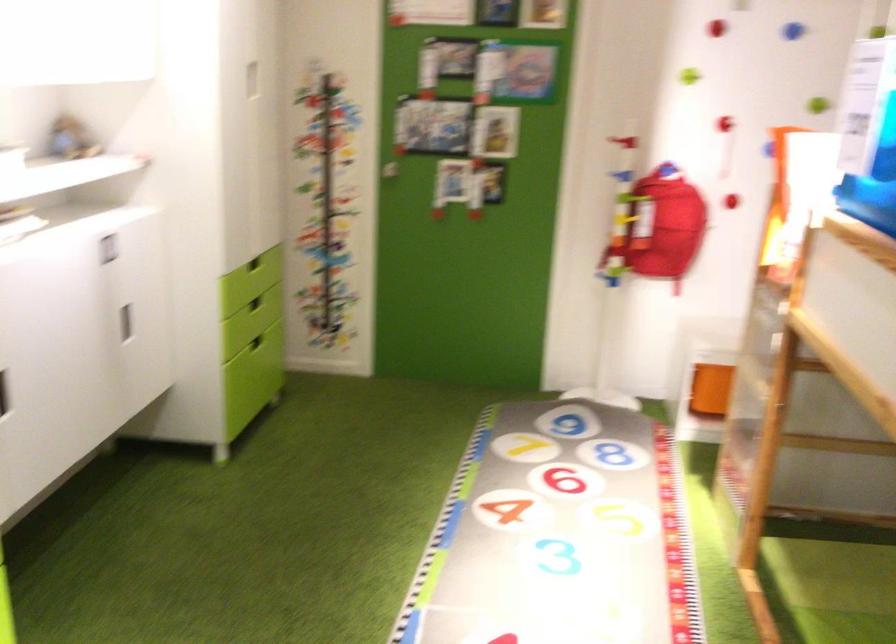
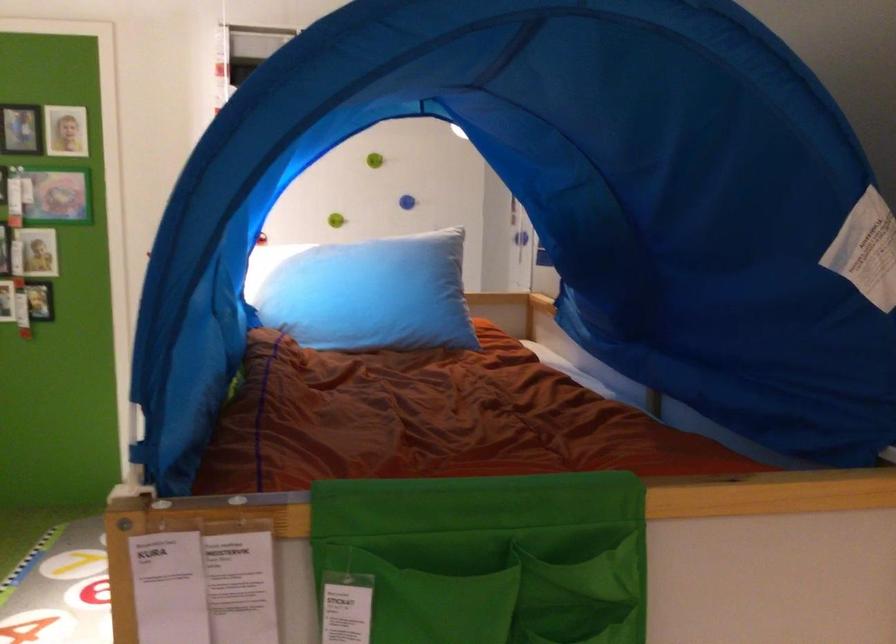
Question: I am providing you with two images of the same scene from different viewpoints. After the viewpoint changes to image2, which objects are now occluded?

Choices:
 (A) small picture frame
 (B) light blue pillow
 (C) yellow pen
 (D) orange plastic container

Answer: (D)